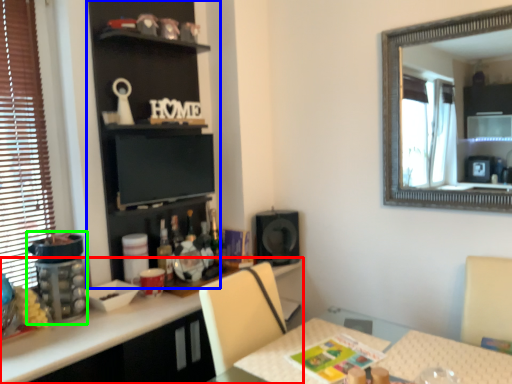
Question: Estimate the real-world distances between objects in this image. Which object is closer to cabinetry (highlighted by a red box), bookshelf (highlighted by a blue box) or appliance (highlighted by a green box)?

Choices:
 (A) bookshelf
 (B) appliance

Answer: (B)